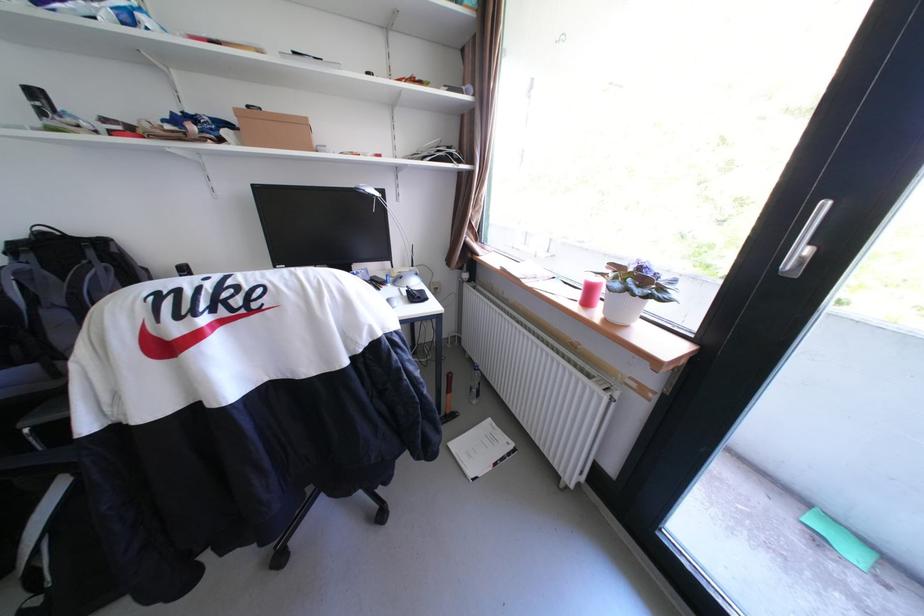
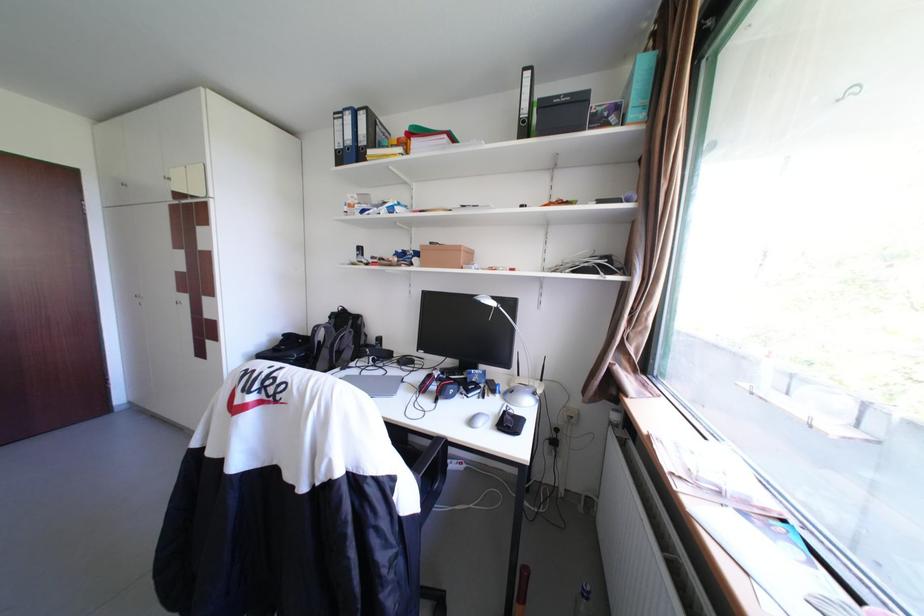
Find the pixel in the second image that matches pixel 405 275 in the first image.

(523, 386)